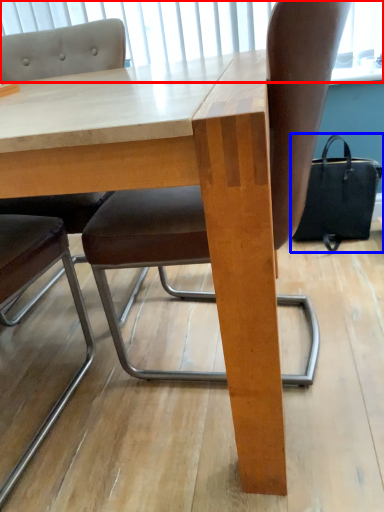
Question: Which object appears closest to the camera in this image, window screen (highlighted by a red box) or handbag (highlighted by a blue box)?

Choices:
 (A) window screen
 (B) handbag

Answer: (A)